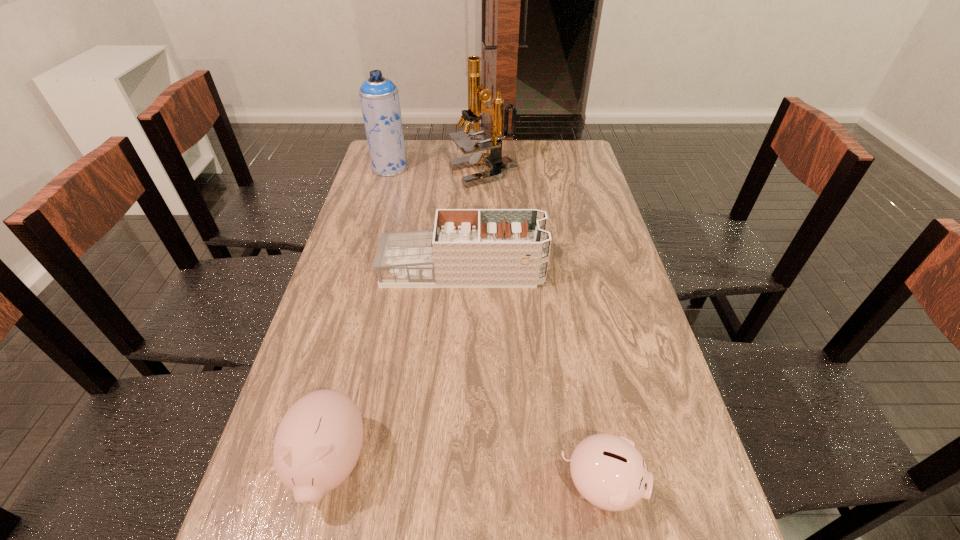
The width and height of the screenshot is (960, 540). Identify the location of vacant point that satisfies the following two spatial constraints: 1. on the back side of the shorter piggy bank; 2. at the eyepiece of the microscope. (541, 173).